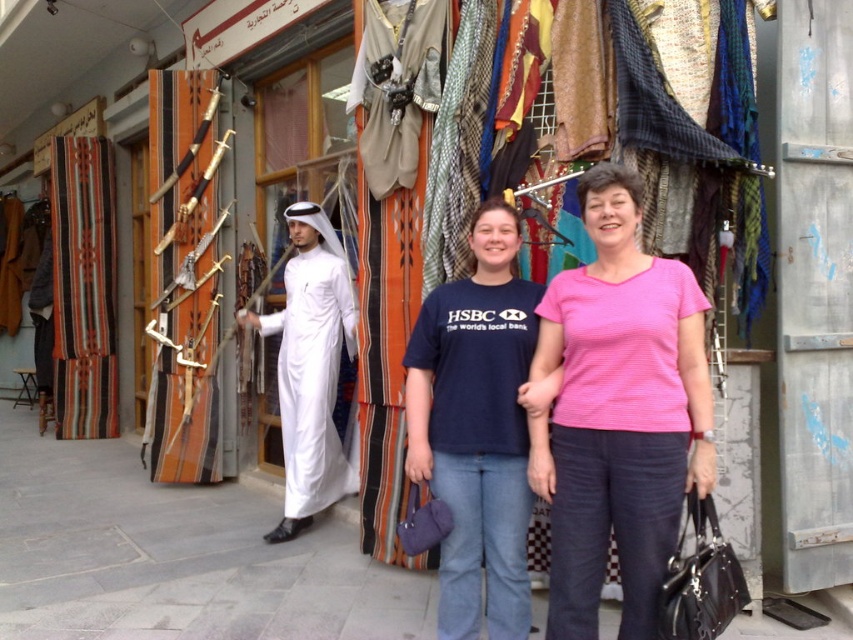
Which is above, pink fabric at center or blue cotton t-shirt at center?

pink fabric at center is higher up.

Image resolution: width=853 pixels, height=640 pixels. In order to click on pink fabric at center in this screenshot , I will do `click(618, 413)`.

From the picture: Measure the distance between point (621,563) and camera.

They are 2.90 meters apart.

You are a GUI agent. You are given a task and a screenshot of the screen. Output one action in this format:
    pyautogui.click(x=<x>, y=<y>)
    Task: Click on the pink fabric at center
    
    Given the screenshot: What is the action you would take?
    pyautogui.click(x=618, y=413)

Does pink fabric at center have a smaller size compared to white cotton robe at center?

Indeed, pink fabric at center has a smaller size compared to white cotton robe at center.

Which is in front, point (647, 280) or point (300, 518)?

Point (647, 280) is in front.

Locate an element on the screen. pink fabric at center is located at coordinates (618, 413).

Is blue cotton t-shirt at center taller than white cotton robe at center?

No.

Who is higher up, blue cotton t-shirt at center or white cotton robe at center?

white cotton robe at center is higher up.

The image size is (853, 640). I want to click on blue cotton t-shirt at center, so click(476, 428).